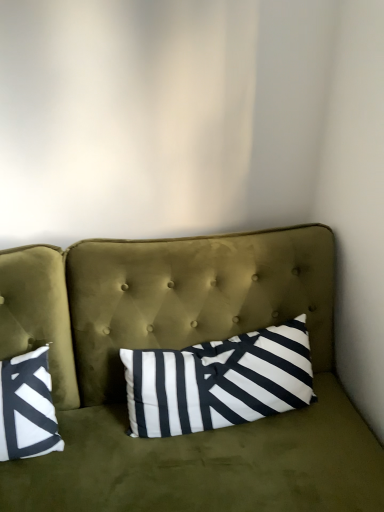
Question: Is olive green velvet couch at center not inside white striped pillow at center?

Choices:
 (A) no
 (B) yes

Answer: (B)

Question: Is olive green velvet couch at center closer to the viewer compared to white striped pillow at center?

Choices:
 (A) no
 (B) yes

Answer: (B)

Question: Is olive green velvet couch at center facing towards white striped pillow at center?

Choices:
 (A) yes
 (B) no

Answer: (A)

Question: Is olive green velvet couch at center oriented away from white striped pillow at center?

Choices:
 (A) yes
 (B) no

Answer: (A)

Question: From the image's perspective, would you say olive green velvet couch at center is shown under white striped pillow at center?

Choices:
 (A) yes
 (B) no

Answer: (A)

Question: Does olive green velvet couch at center appear on the left side of white striped pillow at center?

Choices:
 (A) no
 (B) yes

Answer: (B)

Question: Could you tell me if white striped pillow at center is turned towards olive green velvet couch at center?

Choices:
 (A) no
 (B) yes

Answer: (B)

Question: Is white striped pillow at center completely or partially outside of olive green velvet couch at center?

Choices:
 (A) yes
 (B) no

Answer: (B)

Question: Does white striped pillow at center have a lesser width compared to olive green velvet couch at center?

Choices:
 (A) yes
 (B) no

Answer: (A)

Question: Considering the relative positions of white striped pillow at center and olive green velvet couch at center in the image provided, is white striped pillow at center to the left of olive green velvet couch at center from the viewer's perspective?

Choices:
 (A) yes
 (B) no

Answer: (B)

Question: Considering the relative positions of white striped pillow at center and olive green velvet couch at center in the image provided, is white striped pillow at center to the right of olive green velvet couch at center from the viewer's perspective?

Choices:
 (A) yes
 (B) no

Answer: (A)

Question: Is white striped pillow at center taller than olive green velvet couch at center?

Choices:
 (A) yes
 (B) no

Answer: (B)

Question: Looking at the image, does white striped pillow at center seem bigger or smaller compared to olive green velvet couch at center?

Choices:
 (A) big
 (B) small

Answer: (B)